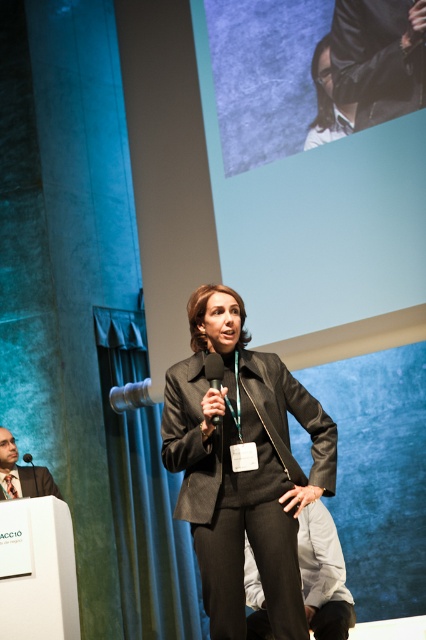
Question: Is dark gray suit at upper right below gray fabric pants at lower center?

Choices:
 (A) no
 (B) yes

Answer: (A)

Question: Which point appears closest to the camera in this image?

Choices:
 (A) (25, 452)
 (B) (327, 36)

Answer: (B)

Question: Can you confirm if gray fabric pants at lower center is wider than matte black suit at lower left?

Choices:
 (A) no
 (B) yes

Answer: (B)

Question: Which of the following is the closest to the observer?

Choices:
 (A) matte black jacket at upper center
 (B) black plastic microphone at center
 (C) matte black suit at center

Answer: (C)

Question: Where is dark gray suit at upper right located in relation to black plastic microphone at center in the image?

Choices:
 (A) above
 (B) below

Answer: (A)

Question: Which point is farther from the camera taking this photo?

Choices:
 (A) (278, 520)
 (B) (336, 588)
 (C) (28, 460)
 (D) (16, 451)

Answer: (D)